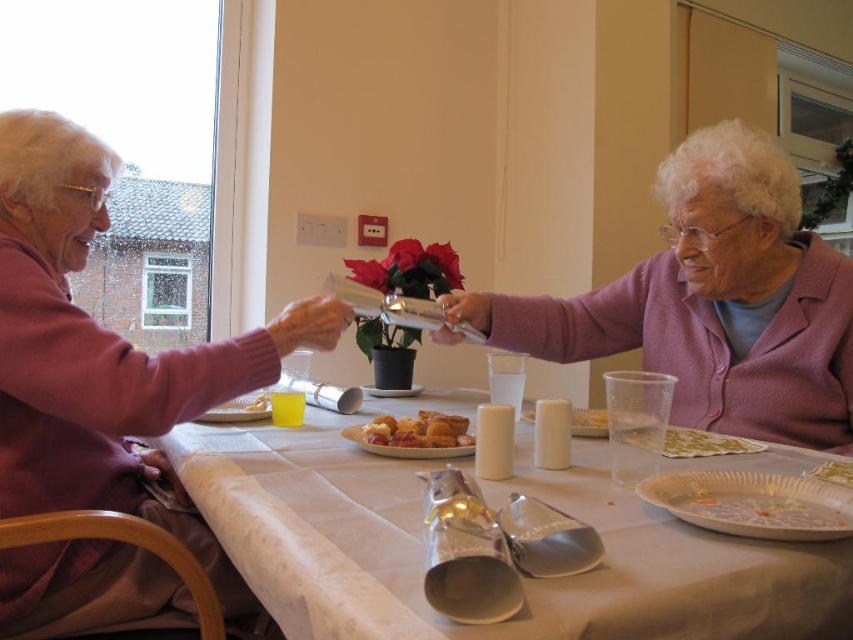
Consider the image. You are a guest at this cozy dining table and want to place a small ornament between the matte purple sweater at left and the golden brown croissant at center. Considering their sizes, which object should you position closer to the center of the table?

The golden brown croissant at center is smaller in size, so you should position it closer to the center of the table to balance the space with the larger matte purple sweater at left.

You are a guest at this cozy indoor gathering. You need to place a small ornament between the matte purple sweater at left and the golden brown croissant at center. Which object should you place it closer to to ensure it doesn

The matte purple sweater at left is taller than the golden brown croissant at center. Therefore, placing the ornament closer to the golden brown croissant at center would ensure it is more stable and less likely to be knocked over by the taller sweater.